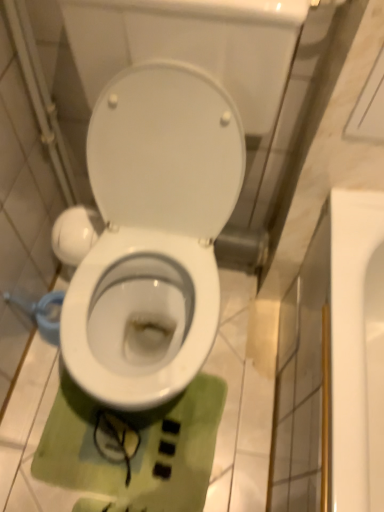
The width and height of the screenshot is (384, 512). I want to click on green fabric doormat at center, so click(x=137, y=449).

This screenshot has height=512, width=384. What do you see at coordinates (137, 449) in the screenshot?
I see `green fabric doormat at center` at bounding box center [137, 449].

The height and width of the screenshot is (512, 384). What are the coordinates of `green fabric doormat at center` in the screenshot? It's located at (137, 449).